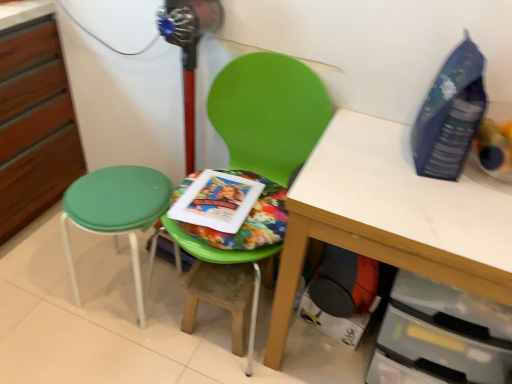
Where is `free space in front of wooden step stool at center`? This screenshot has width=512, height=384. free space in front of wooden step stool at center is located at coordinates (211, 365).